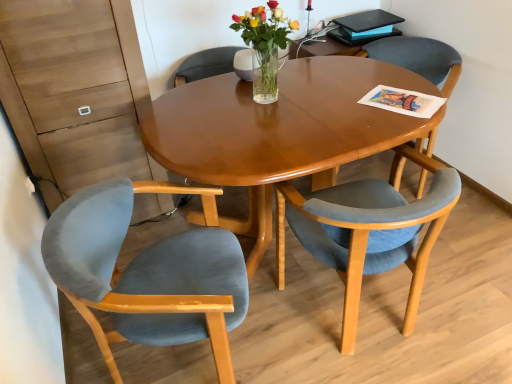
You are a GUI agent. You are given a task and a screenshot of the screen. Output one action in this format:
    pyautogui.click(x=<x>, y=<y>)
    Task: Click on the blank space situated above matte black magazine at upper right (from a real-world perspective)
    The width and height of the screenshot is (512, 384).
    Given the screenshot: What is the action you would take?
    pyautogui.click(x=365, y=25)